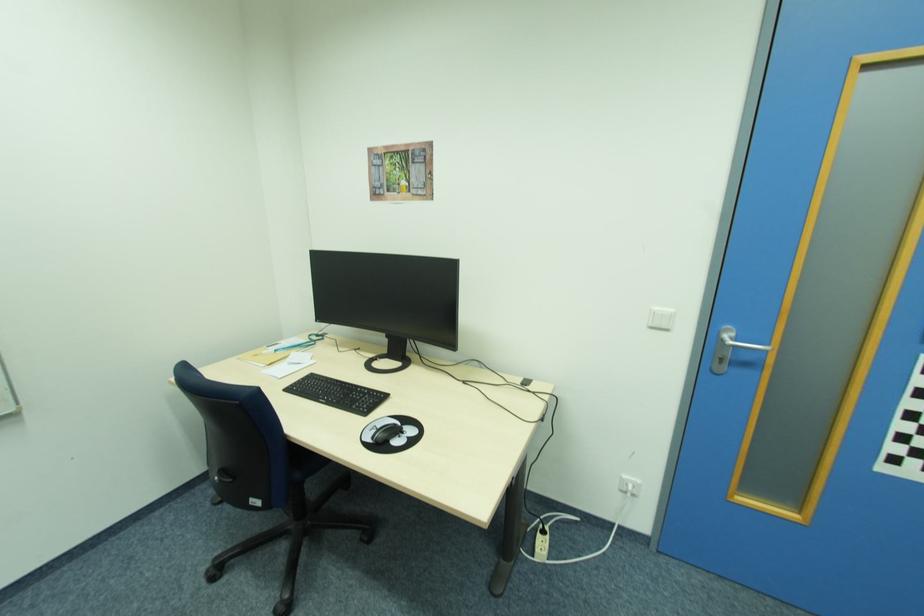
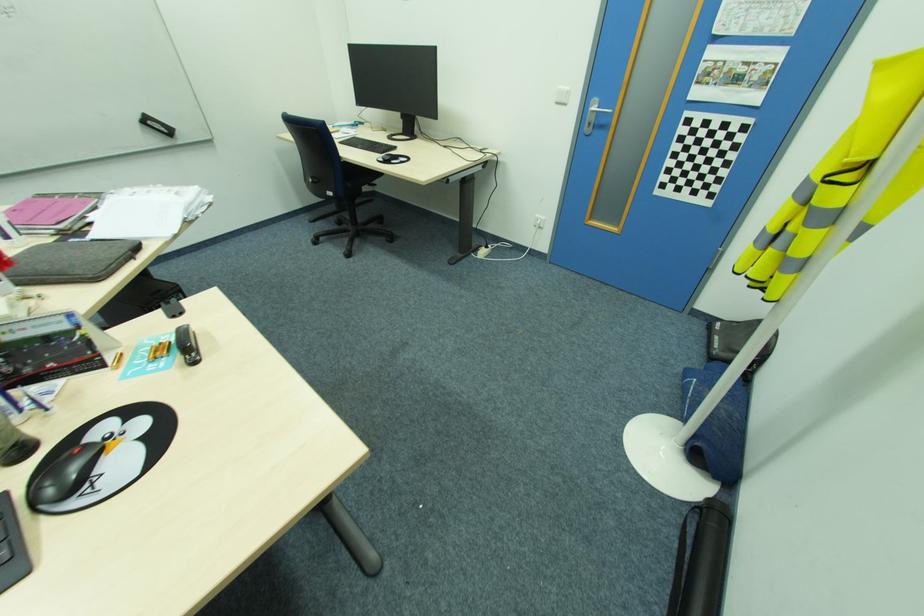
What movement of the cameraman would produce the second image?

The cameraman moved toward right, backward.